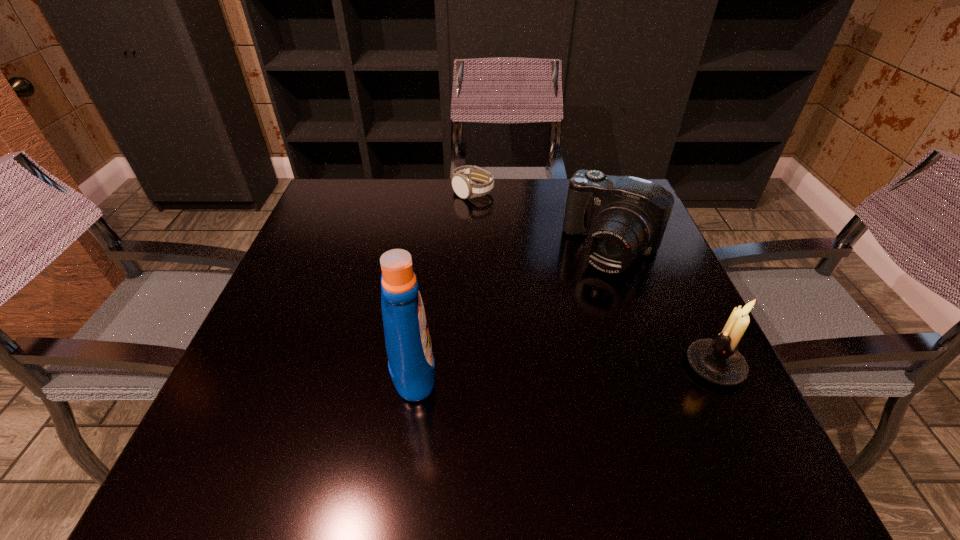
The width and height of the screenshot is (960, 540). In order to click on free space on the desktop that is between the tallest object and the candle holder and is positioned on the face of the watch in this screenshot , I will do `click(524, 366)`.

Find the location of a particular element. This screenshot has width=960, height=540. vacant spot on the desktop that is between the detergent and the candle holder and is positioned on the lens of the camera is located at coordinates (536, 366).